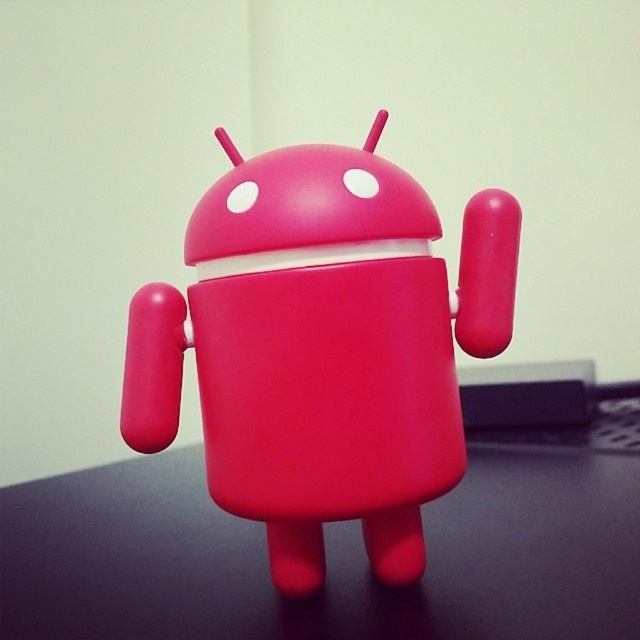
Can you confirm if matte plastic android at center is positioned to the left of rubber-like red table at center?

Correct, you'll find matte plastic android at center to the left of rubber-like red table at center.

Is matte plastic android at center wider than rubber-like red table at center?

No.

What do you see at coordinates (323, 348) in the screenshot? I see `matte plastic android at center` at bounding box center [323, 348].

At what (x,y) coordinates should I click in order to perform the action: click on matte plastic android at center. Please return your answer as a coordinate pair (x, y). The image size is (640, 640). Looking at the image, I should click on (323, 348).